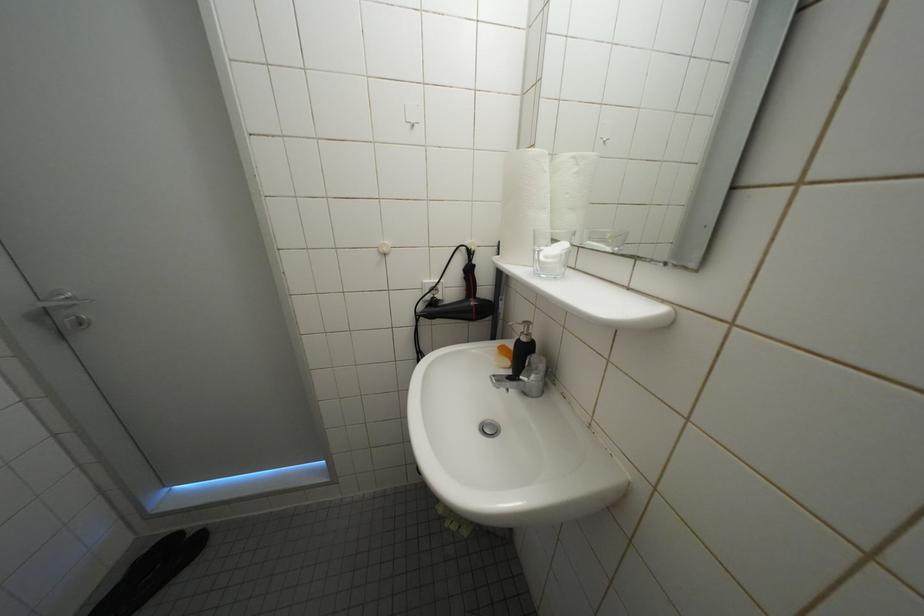
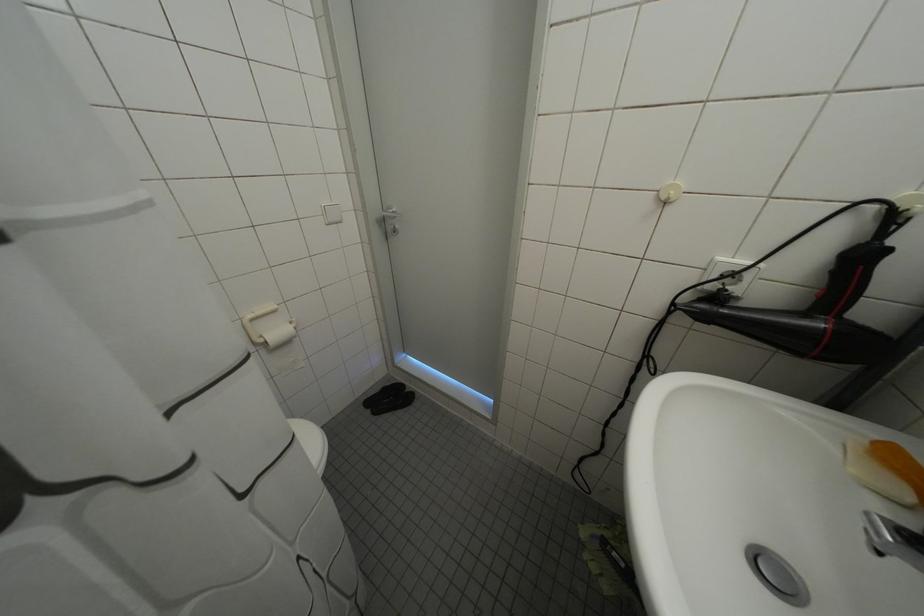
Question: How did the camera likely rotate?

Choices:
 (A) Left
 (B) Right
 (C) Up
 (D) Down

Answer: (A)